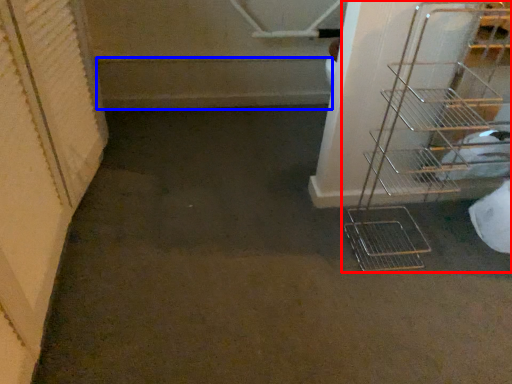
Question: Which point is further to the camera, shelf (highlighted by a red box) or stairs (highlighted by a blue box)?

Choices:
 (A) shelf
 (B) stairs

Answer: (B)